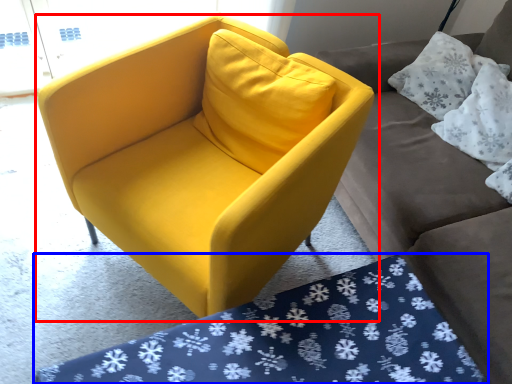
Question: Which point is closer to the camera, chair (highlighted by a red box) or mat (highlighted by a blue box)?

Choices:
 (A) chair
 (B) mat

Answer: (B)